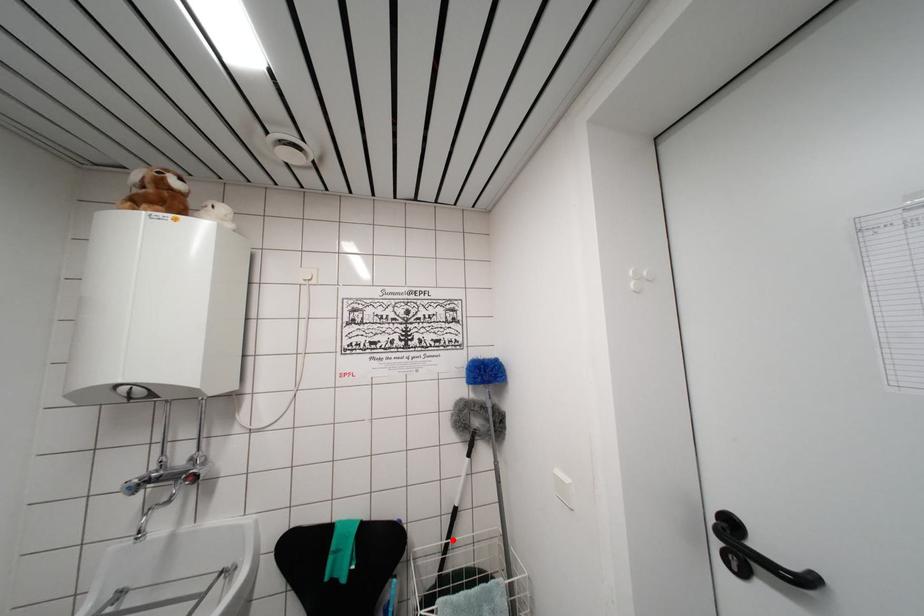
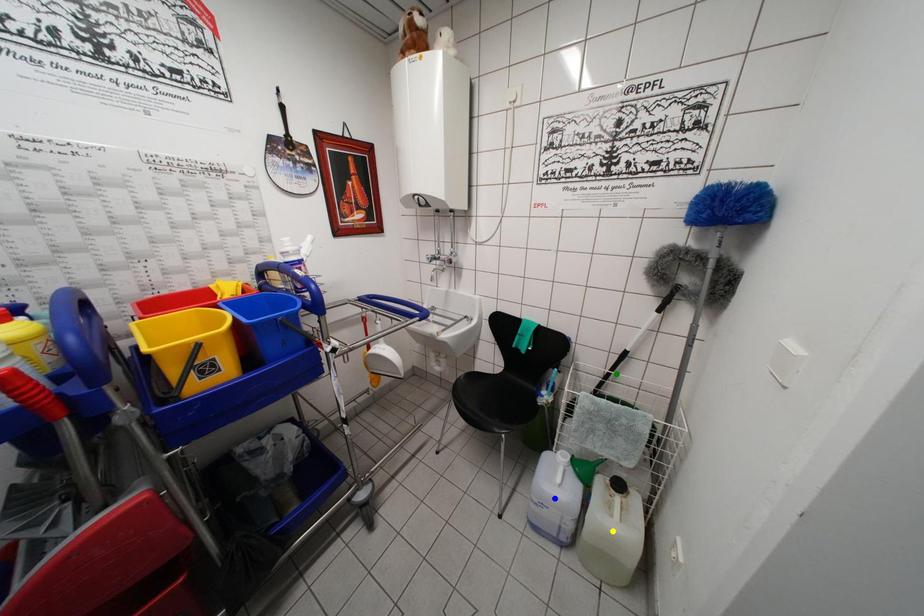
Question: I am providing you with two images of the same scene from different viewpoints. A red point is marked on the first image. You are given multiple points on the second image. Which mark in image 2 goes with the point in image 1?

Choices:
 (A) blue point
 (B) green point
 (C) yellow point

Answer: (B)